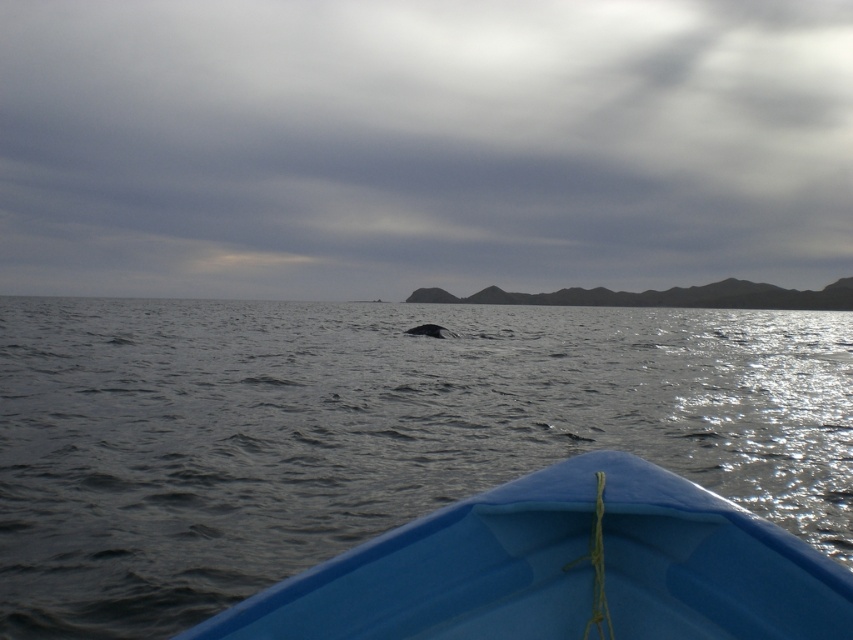
In the scene shown: You are in a small blue boat and looking at the point marked at coordinates (x=421, y=147). Based on the scene, what is the location of this point relative to the gray cloudy sky at upper center?

The point at (x=421, y=147) is located on the gray cloudy sky at upper center.

You are an observer in the small blue boat. You see the gray cloudy sky at upper center and the gray matte whale at center. Which object is closer to you?

The gray matte whale at center is closer to you because the gray cloudy sky at upper center is further away.